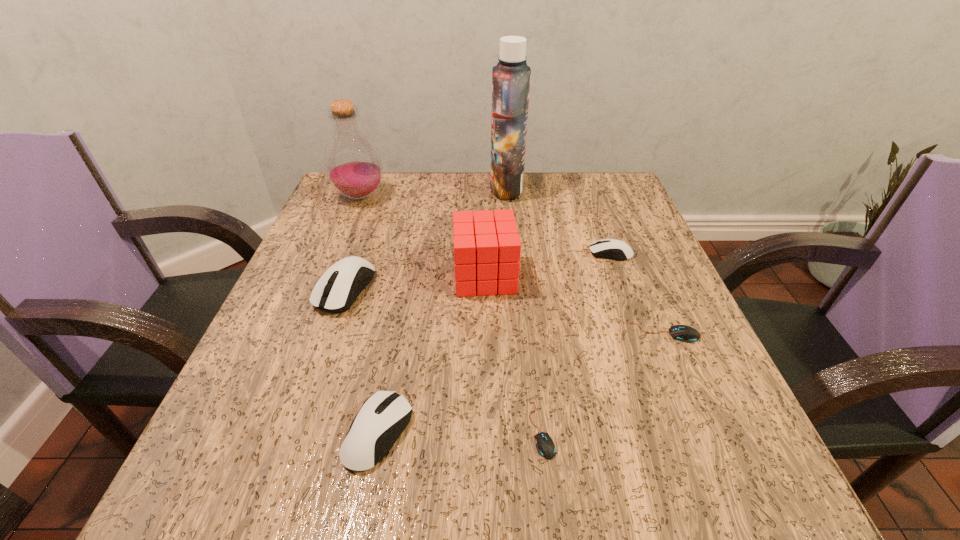
Find the location of a particular element. The image size is (960, 540). free spot that satisfies the following two spatial constraints: 1. on the front label of the shampoo; 2. on the back side of the third nearest object is located at coordinates (519, 333).

Image resolution: width=960 pixels, height=540 pixels. In order to click on free spot that satisfies the following two spatial constraints: 1. on the front side of the smaller black mouse; 2. on the right side of the cube in this screenshot , I will do `click(487, 429)`.

You are a GUI agent. You are given a task and a screenshot of the screen. Output one action in this format:
    pyautogui.click(x=<x>, y=<y>)
    Task: Click on the blank space that satisfies the following two spatial constraints: 1. on the back side of the shortest object; 2. on the right side of the right black mouse
    The height and width of the screenshot is (540, 960).
    Given the screenshot: What is the action you would take?
    pyautogui.click(x=531, y=333)

This screenshot has height=540, width=960. In order to click on free spot that satisfies the following two spatial constraints: 1. on the front label of the blue shampoo; 2. on the front side of the biggest white mouse in this screenshot , I will do `click(516, 289)`.

This screenshot has height=540, width=960. In order to click on free spot that satisfies the following two spatial constraints: 1. on the front side of the fourth shortest mouse; 2. on the left side of the second tallest object in this screenshot , I will do `click(267, 433)`.